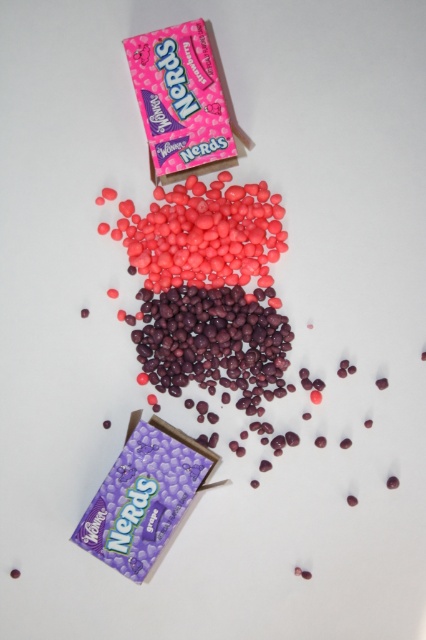
Question: Among these objects, which one is farthest from the camera?

Choices:
 (A) glossy pink nerds at center
 (B) pink matte nerds at upper left

Answer: (A)

Question: Can you confirm if glossy pink nerds at center is bigger than pink matte nerds at upper left?

Choices:
 (A) no
 (B) yes

Answer: (A)

Question: Which of the following is the farthest from the observer?

Choices:
 (A) glossy pink nerds at center
 (B) pink matte nerds at upper left

Answer: (A)

Question: Does glossy pink nerds at center have a larger size compared to pink matte nerds at upper left?

Choices:
 (A) yes
 (B) no

Answer: (B)

Question: Does glossy pink nerds at center appear on the right side of pink matte nerds at upper left?

Choices:
 (A) yes
 (B) no

Answer: (A)